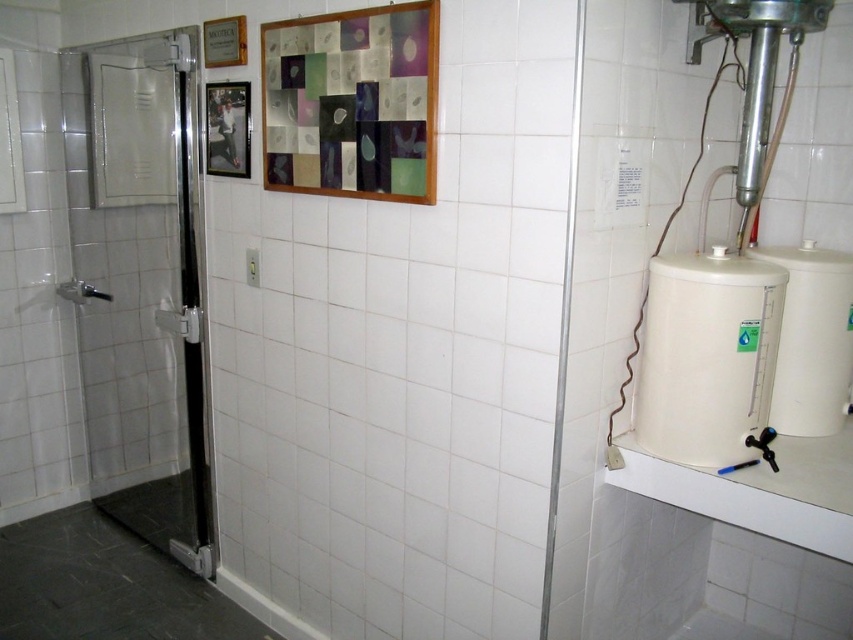
Question: Which object is the farthest from the metallic silver picture frame at upper left?

Choices:
 (A) transparent glass door at left
 (B) white matte water tank at right

Answer: (B)

Question: Considering the real-world distances, which object is closest to the metallic silver picture frame at upper left?

Choices:
 (A) transparent glass door at left
 (B) white matte water tank at right

Answer: (A)

Question: Is transparent glass door at left above white matte water tank at right?

Choices:
 (A) yes
 (B) no

Answer: (A)

Question: Which object is closer to the camera taking this photo?

Choices:
 (A) white matte water tank at right
 (B) transparent glass door at left
 (C) metallic silver picture frame at upper left

Answer: (A)

Question: Does transparent glass door at left appear under white matte water tank at right?

Choices:
 (A) no
 (B) yes

Answer: (A)

Question: Is white matte water tank at right bigger than metallic silver picture frame at upper left?

Choices:
 (A) yes
 (B) no

Answer: (A)